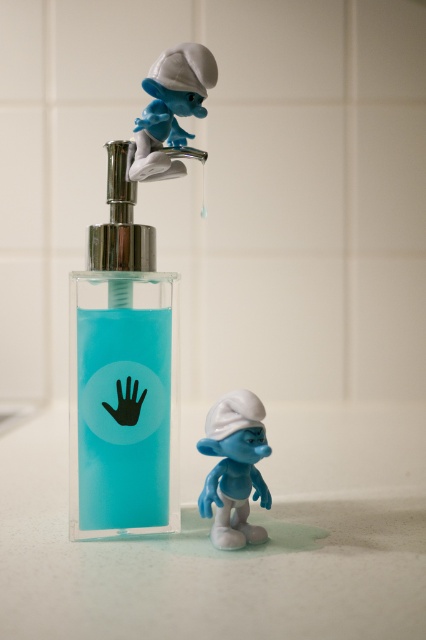
What do you see at coordinates (121, 371) in the screenshot? I see `transparent plastic soap dispenser at center` at bounding box center [121, 371].

Can you confirm if transparent plastic soap dispenser at center is positioned above blue matte smurf at lower center?

Correct, transparent plastic soap dispenser at center is located above blue matte smurf at lower center.

In order to click on transparent plastic soap dispenser at center in this screenshot , I will do `click(121, 371)`.

Can you confirm if transparent plastic soap dispenser at center is positioned to the right of blue matte smurf at upper center?

No, transparent plastic soap dispenser at center is not to the right of blue matte smurf at upper center.

Can you confirm if transparent plastic soap dispenser at center is taller than blue matte smurf at upper center?

Indeed, transparent plastic soap dispenser at center has a greater height compared to blue matte smurf at upper center.

In order to click on transparent plastic soap dispenser at center in this screenshot , I will do `click(121, 371)`.

Does blue matte smurf at lower center appear over blue matte smurf at upper center?

No, blue matte smurf at lower center is not above blue matte smurf at upper center.

Is blue matte smurf at lower center shorter than blue matte smurf at upper center?

Incorrect, blue matte smurf at lower center's height does not fall short of blue matte smurf at upper center's.

Where is `blue matte smurf at lower center`? blue matte smurf at lower center is located at coordinates (235, 468).

Find the location of `blue matte smurf at lower center`. blue matte smurf at lower center is located at coordinates (235, 468).